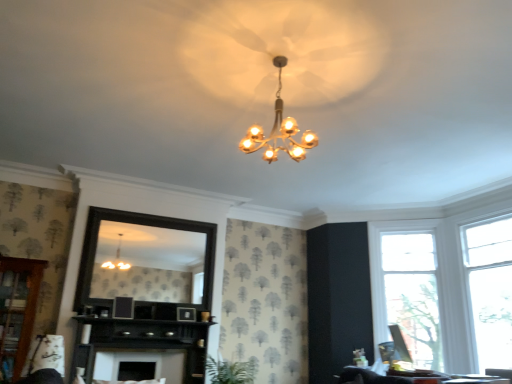
Question: From a real-world perspective, is white fabric swivel chair at lower left positioned above or below black wood fireplace at center, the 1th dresser positioned from the right?

Choices:
 (A) below
 (B) above

Answer: (A)

Question: Considering the positions of white fabric swivel chair at lower left and black wood fireplace at center, the second dresser in the left-to-right sequence, in the image, is white fabric swivel chair at lower left bigger or smaller than black wood fireplace at center, the second dresser in the left-to-right sequence,?

Choices:
 (A) big
 (B) small

Answer: (B)

Question: Estimate the real-world distances between objects in this image. Which object is farther from the green leafy plant at center?

Choices:
 (A) gold metallic chandelier at upper center
 (B) clear glass window at right, which is the 1th window in left-to-right order
 (C) white matte fireplace at lower center
 (D) clear glass window at right, marked as the 1th window in a right-to-left arrangement
 (E) wooden dresser at lower left, which appears as the 1th dresser when viewed from the left

Answer: (D)

Question: Estimate the real-world distances between objects in this image. Which object is farther from the green leafy plant at center?

Choices:
 (A) clear glass window at right, which is the 1th window in left-to-right order
 (B) clear glass window at right, positioned as the 2th window in left-to-right order
 (C) gold metallic chandelier at upper center
 (D) wooden dresser at lower left, which appears as the 1th dresser when viewed from the left
 (E) black wood fireplace at center, the second dresser in the left-to-right sequence

Answer: (B)